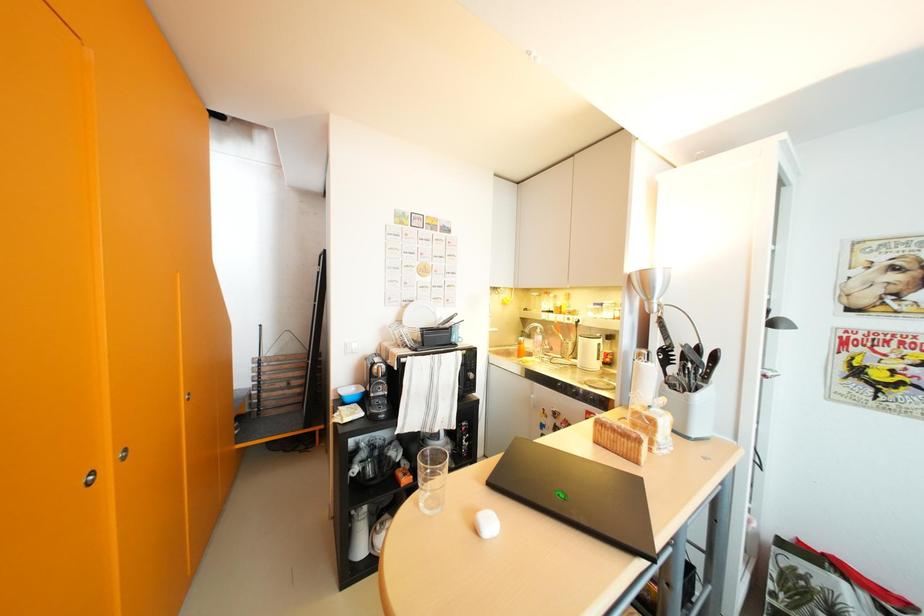
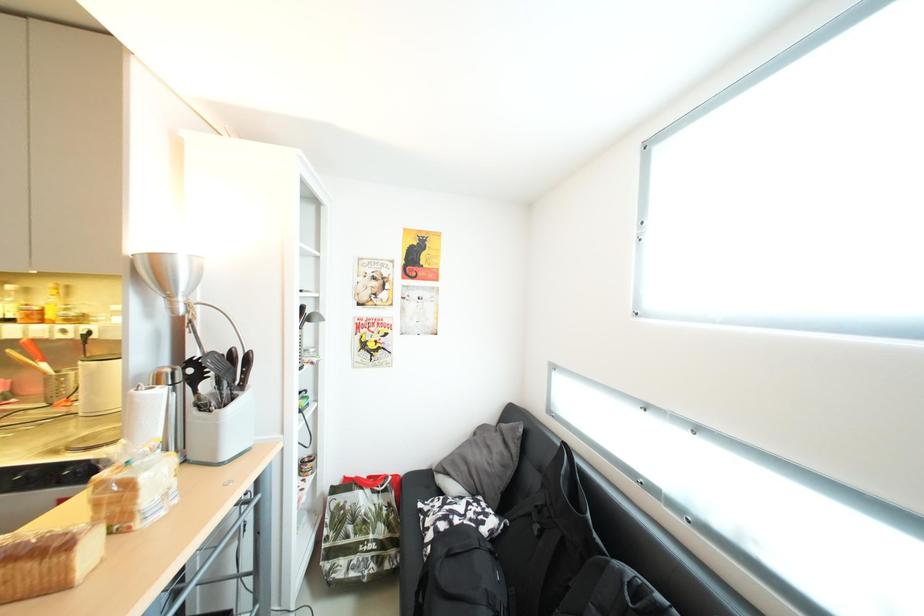
Question: The camera is either moving clockwise (left) or counter-clockwise (right) around the object. The first image is from the beginning of the video and the second image is from the end. Is the camera moving left or right when shooting the video?

Choices:
 (A) Left
 (B) Right

Answer: (A)